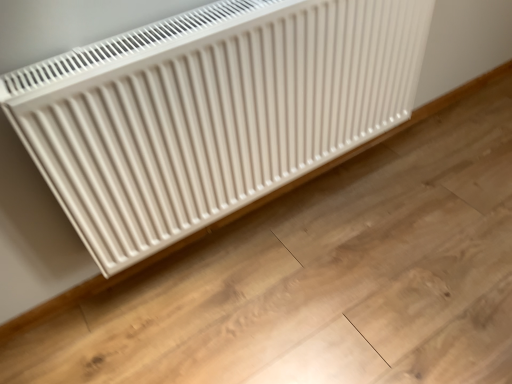
The image size is (512, 384). Find the location of `free space in front of white matte radiator at center`. free space in front of white matte radiator at center is located at coordinates (337, 260).